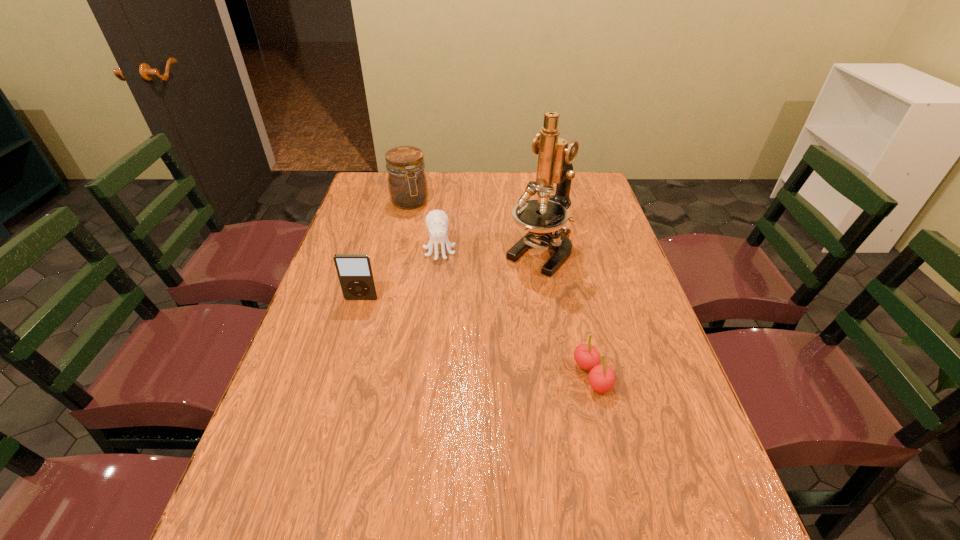
In the image, there is a desktop. Where is `free space at the far left corner`? free space at the far left corner is located at coordinates (382, 186).

This screenshot has height=540, width=960. I want to click on vacant space at the near left corner of the desktop, so click(x=252, y=500).

This screenshot has width=960, height=540. In order to click on free space at the far right corner of the desktop in this screenshot , I will do `click(578, 183)`.

Locate an element on the screen. This screenshot has width=960, height=540. vacant space in between the shortest object and the second nearest object is located at coordinates (477, 338).

At what (x,y) coordinates should I click in order to perform the action: click on vacant area that lies between the fourth tallest object and the farthest object. Please return your answer as a coordinate pair (x, y). Image resolution: width=960 pixels, height=540 pixels. Looking at the image, I should click on (424, 226).

The height and width of the screenshot is (540, 960). I want to click on vacant space that is in between the fourth tallest object and the third shortest object, so click(x=400, y=274).

The image size is (960, 540). I want to click on free space that is in between the tallest object and the third shortest object, so click(451, 275).

Where is `free space between the tallest object and the farthest object`? free space between the tallest object and the farthest object is located at coordinates (475, 227).

What are the coordinates of `vacant point located between the fourth farthest object and the jar` in the screenshot? It's located at (386, 251).

Locate an element on the screen. This screenshot has width=960, height=540. free point between the iPod and the microscope is located at coordinates (451, 275).